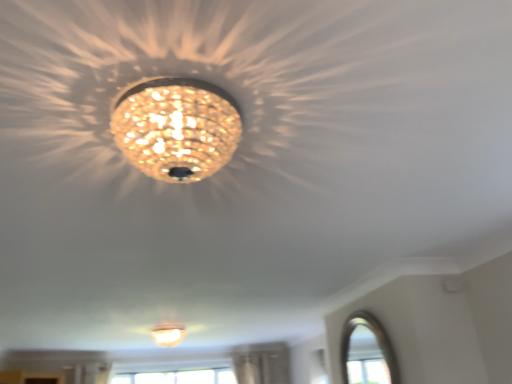
Question: Does matte gold chandelier at center, positioned as the 1th lamp in right-to-left order, have a greater height compared to matte white lampshade at center, acting as the 2th lamp starting from the front?

Choices:
 (A) no
 (B) yes

Answer: (A)

Question: Is matte gold chandelier at center, which appears as the 2th lamp when ordered from the bottom, not near matte white lampshade at center, the second lamp from the right?

Choices:
 (A) no
 (B) yes

Answer: (B)

Question: Is matte gold chandelier at center, which appears as the 2th lamp when viewed from the left, thinner than matte white lampshade at center, positioned as the 1th lamp in back-to-front order?

Choices:
 (A) no
 (B) yes

Answer: (B)

Question: Is matte gold chandelier at center, which appears as the 2th lamp when ordered from the bottom, closer to camera compared to matte white lampshade at center, the second lamp from the right?

Choices:
 (A) no
 (B) yes

Answer: (B)

Question: Is matte gold chandelier at center, the first lamp positioned from the top, looking in the opposite direction of matte white lampshade at center, which ranks as the 1th lamp in left-to-right order?

Choices:
 (A) no
 (B) yes

Answer: (B)

Question: In terms of width, does matte gold chandelier at center, which is the 2th lamp in back-to-front order, look wider or thinner when compared to clear glass window at lower right?

Choices:
 (A) thin
 (B) wide

Answer: (B)

Question: Is matte gold chandelier at center, which is the 2th lamp in back-to-front order, to the left or to the right of clear glass window at lower right in the image?

Choices:
 (A) left
 (B) right

Answer: (A)

Question: In the image, is matte gold chandelier at center, positioned as the 1th lamp in right-to-left order, positioned in front of or behind clear glass window at lower right?

Choices:
 (A) front
 (B) behind

Answer: (A)

Question: Choose the correct answer: Is matte gold chandelier at center, which appears as the 2th lamp when ordered from the bottom, inside clear glass window at lower right or outside it?

Choices:
 (A) outside
 (B) inside

Answer: (A)

Question: Do you think matte white lampshade at center, positioned as the first lamp in bottom-to-top order, is within matte gold chandelier at center, the first lamp positioned from the top, or outside of it?

Choices:
 (A) inside
 (B) outside

Answer: (B)

Question: Is matte white lampshade at center, acting as the 2th lamp starting from the front, wider or thinner than matte gold chandelier at center, positioned as the 1th lamp in right-to-left order?

Choices:
 (A) thin
 (B) wide

Answer: (B)

Question: Considering their positions, is matte white lampshade at center, arranged as the second lamp when viewed from the top, located in front of or behind matte gold chandelier at center, the first lamp positioned from the top?

Choices:
 (A) front
 (B) behind

Answer: (B)

Question: Visually, is matte white lampshade at center, arranged as the second lamp when viewed from the top, positioned to the left or to the right of matte gold chandelier at center, which appears as the 2th lamp when viewed from the left?

Choices:
 (A) left
 (B) right

Answer: (A)

Question: From the image's perspective, is clear glass window at lower right located above or below matte gold chandelier at center, which appears as the 2th lamp when viewed from the left?

Choices:
 (A) above
 (B) below

Answer: (B)

Question: Is clear glass window at lower right wider or thinner than matte gold chandelier at center, positioned as the 1th lamp in right-to-left order?

Choices:
 (A) wide
 (B) thin

Answer: (B)